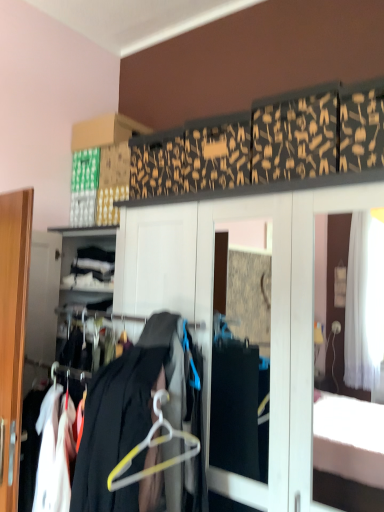
Locate an element on the screen. black fabric coat at center is located at coordinates pos(142,419).

Describe the element at coordinates (142, 419) in the screenshot. I see `black fabric coat at center` at that location.

Describe the element at coordinates (153, 447) in the screenshot. I see `white plastic hanger at center` at that location.

Where is `white plastic hanger at center`? Image resolution: width=384 pixels, height=512 pixels. white plastic hanger at center is located at coordinates (153, 447).

Identify the location of black fabric coat at center. (142, 419).

Based on their positions, is black fabric coat at center located to the left or right of white plastic hanger at center?

black fabric coat at center is positioned on white plastic hanger at center's left side.

Is black fabric coat at center positioned behind white plastic hanger at center?

No, it is not.

Considering the points (166, 476) and (157, 422), which point is in front, point (166, 476) or point (157, 422)?

The point (157, 422) is more forward.

In the scene shown: From the image's perspective, between black fabric coat at center and white plastic hanger at center, which one is located above?

white plastic hanger at center is shown above in the image.

From a real-world perspective, between black fabric coat at center and white plastic hanger at center, who is vertically higher?

From a 3D spatial view, white plastic hanger at center is above.

Looking at this image, between black fabric coat at center and white plastic hanger at center, which one has smaller width?

white plastic hanger at center.

Between black fabric coat at center and white plastic hanger at center, which one has less height?

white plastic hanger at center.

Which of these two, black fabric coat at center or white plastic hanger at center, is bigger?

Bigger between the two is black fabric coat at center.

Is black fabric coat at center positioned beyond the bounds of white plastic hanger at center?

black fabric coat at center lies outside white plastic hanger at center's area.

Can you see black fabric coat at center touching white plastic hanger at center?

Yes.

In the scene shown: Is black fabric coat at center oriented towards white plastic hanger at center?

No.

Can you tell me how much black fabric coat at center and white plastic hanger at center differ in facing direction?

The facing directions of black fabric coat at center and white plastic hanger at center are 0.451 degrees apart.

How much distance is there between black fabric coat at center and white plastic hanger at center?

black fabric coat at center and white plastic hanger at center are 3.46 inches apart from each other.

Where is `hanger that is above the black fabric coat at center (from a real-world perspective)`? This screenshot has height=512, width=384. hanger that is above the black fabric coat at center (from a real-world perspective) is located at coordinates (153, 447).

Considering the positions of objects white plastic hanger at center and black fabric coat at center in the image provided, who is more to the right, white plastic hanger at center or black fabric coat at center?

white plastic hanger at center.

Relative to black fabric coat at center, is white plastic hanger at center in front or behind?

Clearly, white plastic hanger at center is behind black fabric coat at center.

Does point (116, 489) come in front of point (139, 469)?

Yes.

From the image's perspective, is white plastic hanger at center above or below black fabric coat at center?

Clearly, from the image's perspective, white plastic hanger at center is above black fabric coat at center.

From a real-world perspective, between white plastic hanger at center and black fabric coat at center, who is vertically lower?

black fabric coat at center.

Between white plastic hanger at center and black fabric coat at center, which one has smaller width?

With smaller width is white plastic hanger at center.

Which of these two, white plastic hanger at center or black fabric coat at center, stands taller?

black fabric coat at center is taller.

Considering the relative sizes of white plastic hanger at center and black fabric coat at center in the image provided, is white plastic hanger at center bigger than black fabric coat at center?

No, white plastic hanger at center is not bigger than black fabric coat at center.

Could black fabric coat at center be considered to be inside white plastic hanger at center?

No, black fabric coat at center is not inside white plastic hanger at center.

Is white plastic hanger at center placed right next to black fabric coat at center?

Yes.

Is white plastic hanger at center aimed at black fabric coat at center?

Yes, white plastic hanger at center is turned towards black fabric coat at center.

How distant is white plastic hanger at center from black fabric coat at center?

They are 3.46 inches apart.

Where is `hanger to the right of black fabric coat at center`? hanger to the right of black fabric coat at center is located at coordinates (153, 447).

Where is `clothing lying on the left of white plastic hanger at center`? The image size is (384, 512). clothing lying on the left of white plastic hanger at center is located at coordinates (142, 419).

Find the location of `clothing below the white plastic hanger at center (from the image's perspective)`. clothing below the white plastic hanger at center (from the image's perspective) is located at coordinates (142, 419).